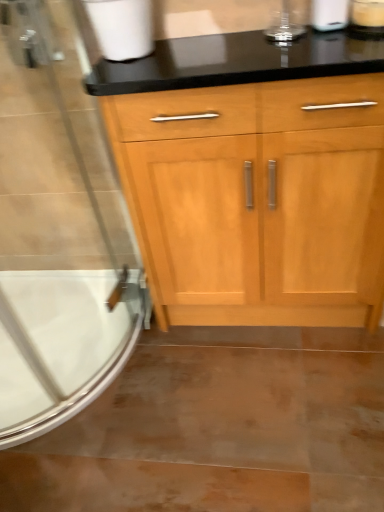
Where is `vacant area that is in front of clear glass screen door at left`? The width and height of the screenshot is (384, 512). vacant area that is in front of clear glass screen door at left is located at coordinates pos(148,433).